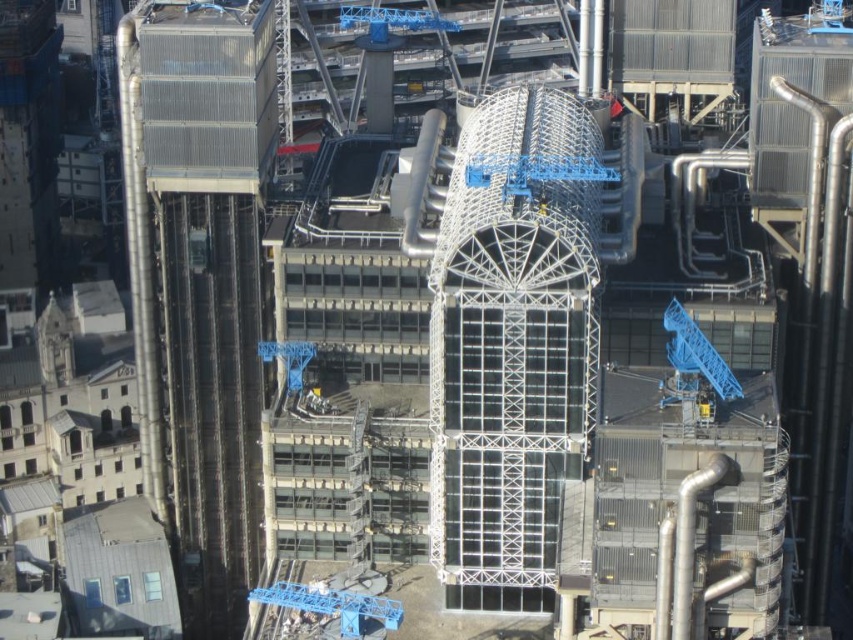
Question: Which of these objects is positioned closest to the blue metallic crane at upper center?

Choices:
 (A) metallic glass tower at left
 (B) transparent glass tower at center

Answer: (A)

Question: Where is metallic glass tower at left located in relation to transparent glass tower at center in the image?

Choices:
 (A) below
 (B) above

Answer: (A)

Question: Considering the relative positions of transparent glass tower at center and blue metallic crane at upper center in the image provided, where is transparent glass tower at center located with respect to blue metallic crane at upper center?

Choices:
 (A) left
 (B) right

Answer: (B)

Question: Which of the following is the farthest from the observer?

Choices:
 (A) (436, 12)
 (B) (209, 253)

Answer: (A)

Question: Which object is the closest to the transparent glass tower at center?

Choices:
 (A) metallic glass tower at left
 (B) blue metallic crane at upper center

Answer: (A)

Question: Can you confirm if transparent glass tower at center is positioned to the left of blue metallic crane at upper center?

Choices:
 (A) yes
 (B) no

Answer: (B)